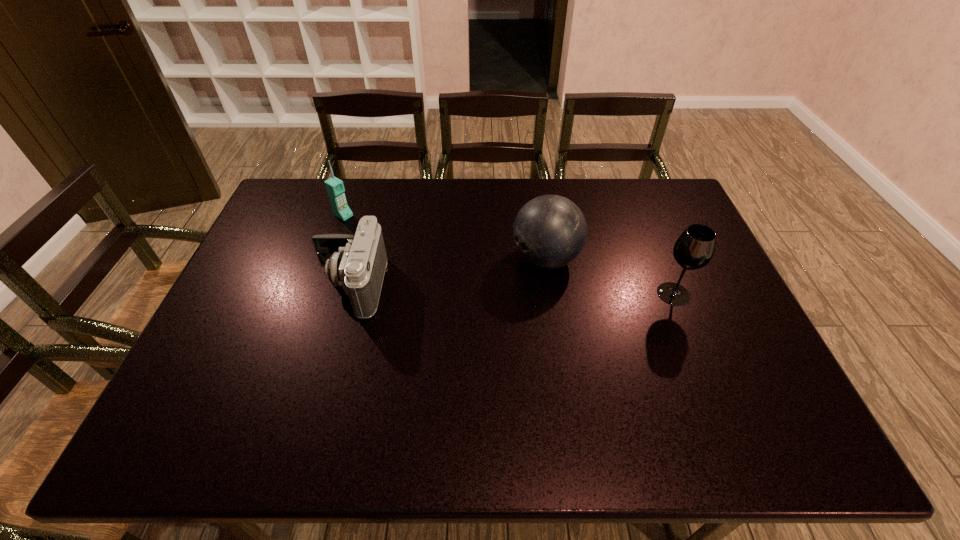
You are a GUI agent. You are given a task and a screenshot of the screen. Output one action in this format:
    pyautogui.click(x=<x>, y=<y>)
    Task: Click on the shortest object
    This screenshot has height=540, width=960.
    Given the screenshot: What is the action you would take?
    pyautogui.click(x=357, y=262)

The height and width of the screenshot is (540, 960). I want to click on wineglass, so click(x=694, y=249).

Find the location of a particular element. bowling ball is located at coordinates (550, 231).

The width and height of the screenshot is (960, 540). What are the coordinates of `cellular telephone` in the screenshot? It's located at coord(335,189).

Where is `free region located 0.140m at the front of the shortest object with an open lens cover`? free region located 0.140m at the front of the shortest object with an open lens cover is located at coordinates (268, 286).

The height and width of the screenshot is (540, 960). Find the location of `vacant space situated 0.050m at the front of the shortest object with an open lens cover`. vacant space situated 0.050m at the front of the shortest object with an open lens cover is located at coordinates (299, 286).

At what (x,y) coordinates should I click in order to perform the action: click on vacant space located 0.220m at the front of the shortest object with an open lens cover. Please return your answer as a coordinate pair (x, y). This screenshot has width=960, height=540. Looking at the image, I should click on (239, 286).

Locate an element on the screen. This screenshot has width=960, height=540. vacant space located 0.100m on the back of the rightmost object is located at coordinates (659, 258).

This screenshot has height=540, width=960. Identify the location of vacant space positioned 0.190m on the grip area of the second object from right to left. (x=461, y=296).

At what (x,y) coordinates should I click in order to perform the action: click on free region located on the grip area of the second object from right to left. Please return your answer as a coordinate pair (x, y). Looking at the image, I should click on (415, 316).